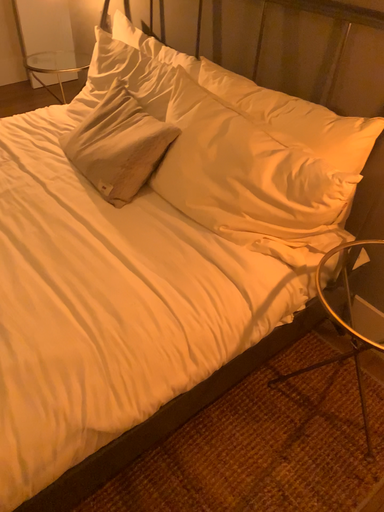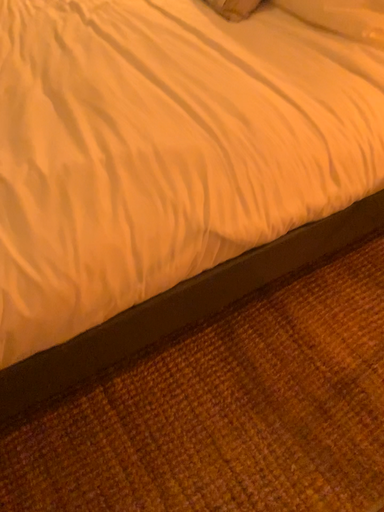
Question: How did the camera likely rotate when shooting the video?

Choices:
 (A) rotated left
 (B) rotated right

Answer: (A)